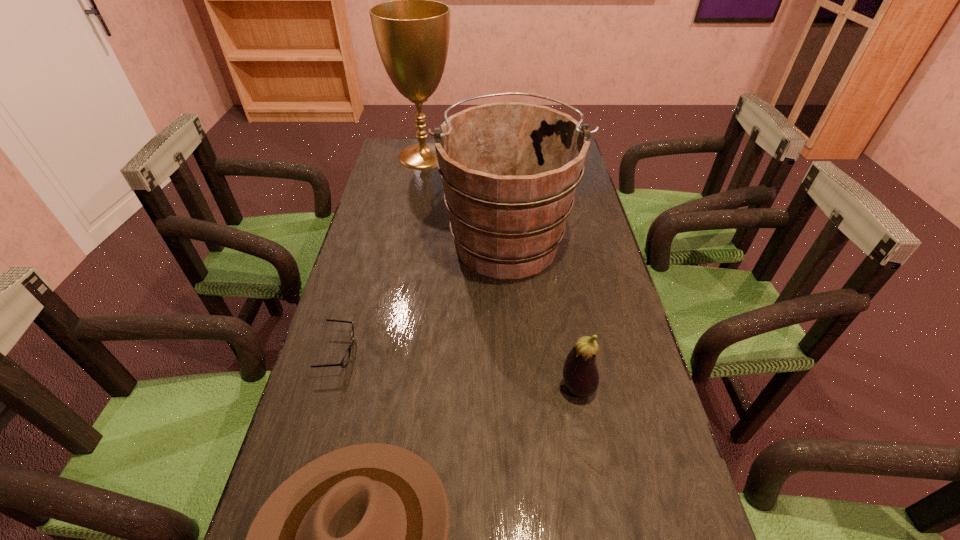
The height and width of the screenshot is (540, 960). Find the location of `the farthest object`. the farthest object is located at coordinates (412, 33).

You are a GUI agent. You are given a task and a screenshot of the screen. Output one action in this format:
    pyautogui.click(x=<x>, y=<y>)
    Task: Click on the tallest object
    The image size is (960, 540).
    Given the screenshot: What is the action you would take?
    pyautogui.click(x=412, y=33)

Where is `bucket`? bucket is located at coordinates (509, 170).

Locate an element on the screen. This screenshot has height=540, width=960. the fourth shortest object is located at coordinates (509, 170).

You are a GUI agent. You are given a task and a screenshot of the screen. Output one action in this format:
    pyautogui.click(x=<x>, y=<y>)
    Task: Click on the eggplant
    Image resolution: width=960 pixels, height=540 pixels.
    Given the screenshot: What is the action you would take?
    pyautogui.click(x=580, y=373)

What are the coordinates of `spectacles` in the screenshot? It's located at (344, 362).

This screenshot has height=540, width=960. I want to click on free location located 0.350m on the front of the tallest object, so click(410, 231).

Locate an element on the screen. vacant space located 0.160m on the handle side of the second tallest object is located at coordinates (503, 173).

You are a GUI agent. You are given a task and a screenshot of the screen. Output one action in this format:
    pyautogui.click(x=<x>, y=<y>)
    Task: Click on the free space located 0.100m on the handle side of the second tallest object
    The height and width of the screenshot is (540, 960).
    Given the screenshot: What is the action you would take?
    pyautogui.click(x=504, y=181)

Locate an element on the screen. This screenshot has width=960, height=540. vacant point located 0.260m on the handle side of the second tallest object is located at coordinates (502, 159).